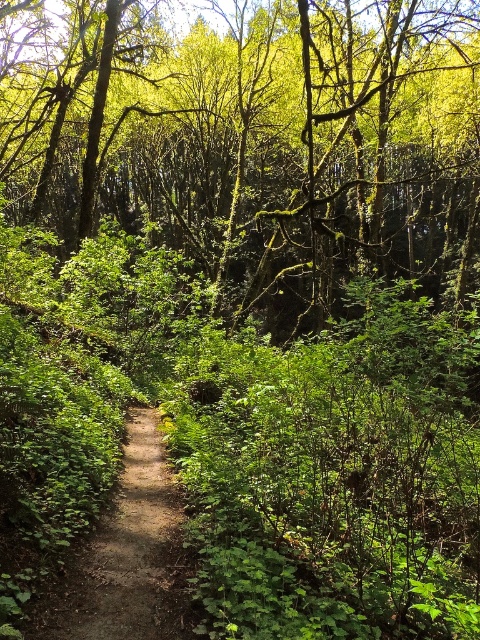
Question: Is green leafy tree at center positioned in front of dirt path at center?

Choices:
 (A) yes
 (B) no

Answer: (B)

Question: Can you confirm if green leafy tree at center is wider than dirt path at center?

Choices:
 (A) yes
 (B) no

Answer: (A)

Question: Does green leafy tree at center have a smaller size compared to dirt path at center?

Choices:
 (A) yes
 (B) no

Answer: (B)

Question: Which point is closer to the camera?

Choices:
 (A) (316, 252)
 (B) (180, 528)

Answer: (B)

Question: Which point is closer to the camera?

Choices:
 (A) (x=407, y=100)
 (B) (x=129, y=508)

Answer: (B)